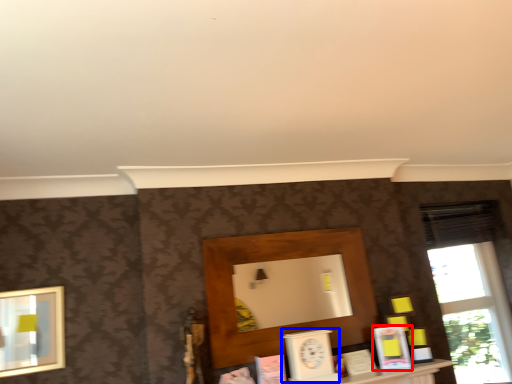
Question: Which point is further to the camera, book (highlighted by a red box) or clock (highlighted by a blue box)?

Choices:
 (A) book
 (B) clock

Answer: (A)